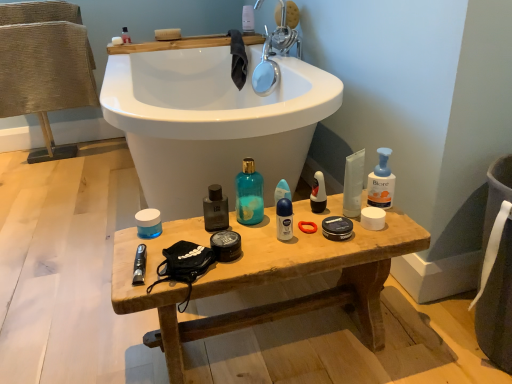
The image size is (512, 384). In order to click on blank space to the left of wooden bench at center in this screenshot , I will do `click(82, 324)`.